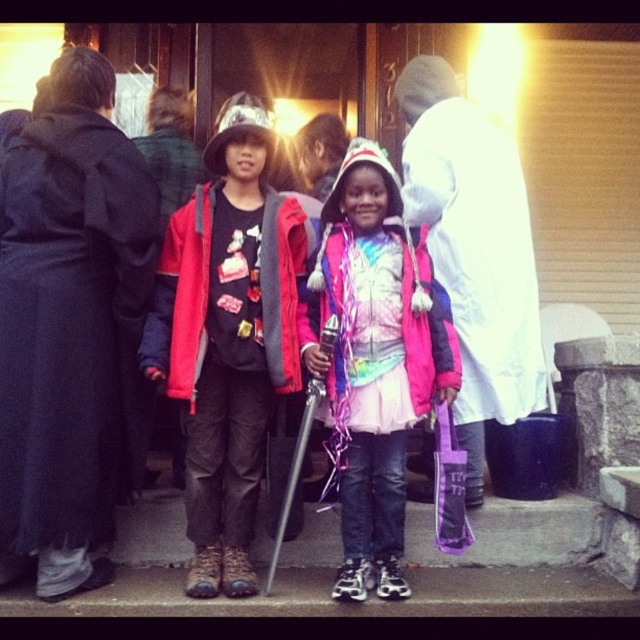
You are a photographer trying to capture a photo of both the pink fabric umbrella at center and the matte red jacket at center. Since you want both items to be clearly visible in the frame, which object should you position closer to the camera to ensure both are in focus?

To ensure both the pink fabric umbrella at center and the matte red jacket at center are in focus, position the pink fabric umbrella at center closer to the camera since it is already to the right of the matte red jacket at center, which might mean it is farther away. Adjusting their positions so both are at a similar distance from the camera will help maintain focus on both.

You are a photographer setting up for a group photo at the event. You notice the black matte robe at left and the matte red jacket at center. Which object should you adjust to ensure both are fully visible in the frame?

The black matte robe at left is positioned under the matte red jacket at center. To ensure both are fully visible, adjust the matte red jacket at center to move it upwards or the black matte robe at left to move it upwards.